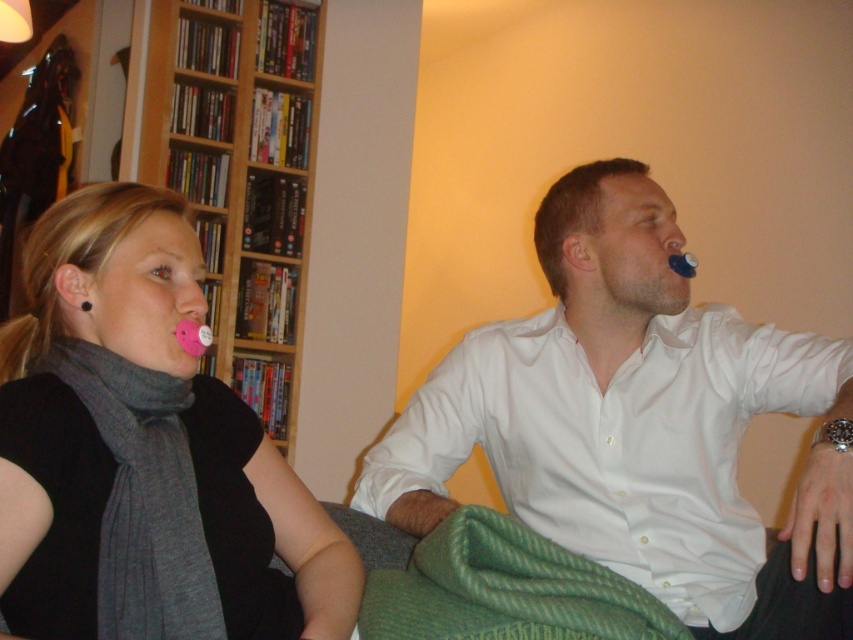
Between matte pink pacifier at left and wooden bookshelf at upper left, which one has less height?

Standing shorter between the two is matte pink pacifier at left.

Between point (0, 563) and point (286, 253), which one is positioned behind?

Point (286, 253)

Who is more distant from viewer, (131, 300) or (252, 52)?

Positioned behind is point (252, 52).

I want to click on matte pink pacifier at left, so click(114, 452).

Is point (569, 262) more distant than point (306, 246)?

No.

Which is below, white smooth shirt at upper right or wooden bookshelf at upper left?

Positioned lower is white smooth shirt at upper right.

What are the coordinates of `white smooth shirt at upper right` in the screenshot? It's located at (637, 424).

What are the coordinates of `white smooth shirt at upper right` in the screenshot? It's located at (637, 424).

You are a GUI agent. You are given a task and a screenshot of the screen. Output one action in this format:
    pyautogui.click(x=<x>, y=<y>)
    Task: Click on the white smooth shirt at upper right
    This screenshot has width=853, height=640.
    Given the screenshot: What is the action you would take?
    pyautogui.click(x=637, y=424)

Does white smooth shirt at upper right have a smaller size compared to matte pink pacifier at left?

No.

Is point (643, 461) closer to viewer compared to point (142, 216)?

No.

This screenshot has height=640, width=853. What are the coordinates of `white smooth shirt at upper right` in the screenshot? It's located at (637, 424).